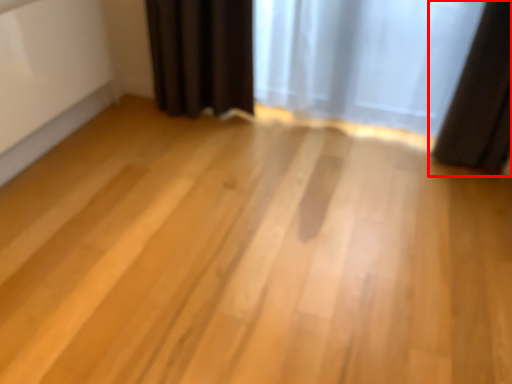
Question: From the image, what is the correct spatial relationship of curtain (annotated by the red box) in relation to curtain?

Choices:
 (A) left
 (B) right

Answer: (B)